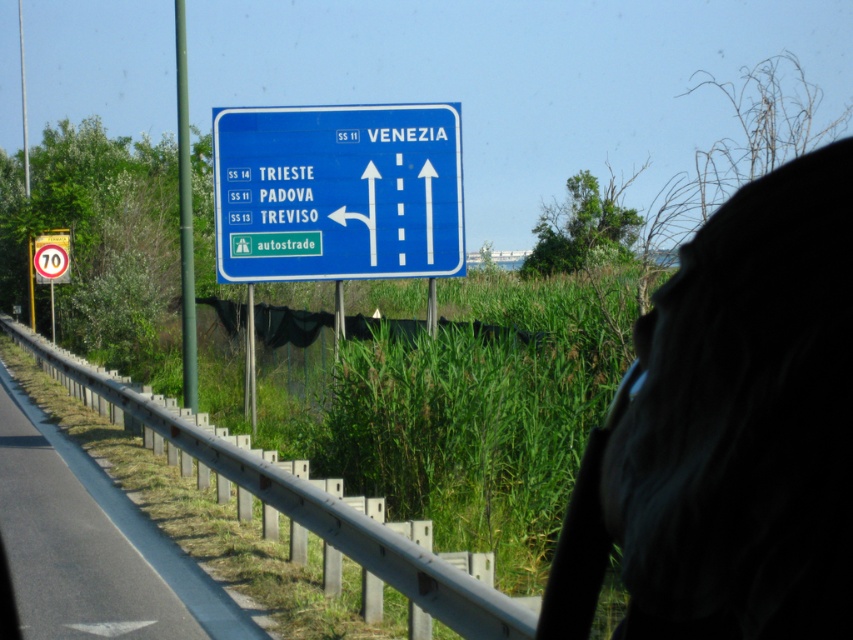
Question: Can you confirm if dark fabric scarf at upper right is positioned to the right of metallic gray guardrail at lower left?

Choices:
 (A) no
 (B) yes

Answer: (B)

Question: Which point is closer to the camera?

Choices:
 (A) (712, 269)
 (B) (39, 257)

Answer: (A)

Question: Can you confirm if dark fabric scarf at upper right is smaller than metallic gray guardrail at lower left?

Choices:
 (A) no
 (B) yes

Answer: (B)

Question: Which point is farther from the camera taking this photo?

Choices:
 (A) (393, 132)
 (B) (57, 250)
 (C) (653, 380)
 (D) (219, 595)

Answer: (B)

Question: Estimate the real-world distances between objects in this image. Which object is farther from the blue plastic sign at upper center?

Choices:
 (A) yellow reflective speed limit sign at upper left
 (B) dark fabric scarf at upper right
 (C) metallic gray guardrail at lower left

Answer: (A)

Question: Does dark fabric scarf at upper right lie behind yellow reflective speed limit sign at upper left?

Choices:
 (A) yes
 (B) no

Answer: (B)